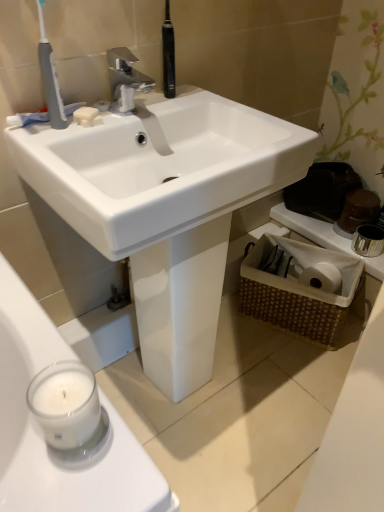
You are a GUI agent. You are given a task and a screenshot of the screen. Output one action in this format:
    pyautogui.click(x=<x>, y=<y>)
    Task: Click on the vacant area located to the right-hand side of gray plastic toothbrush at upper left
    This screenshot has width=384, height=512.
    Given the screenshot: What is the action you would take?
    pyautogui.click(x=127, y=117)